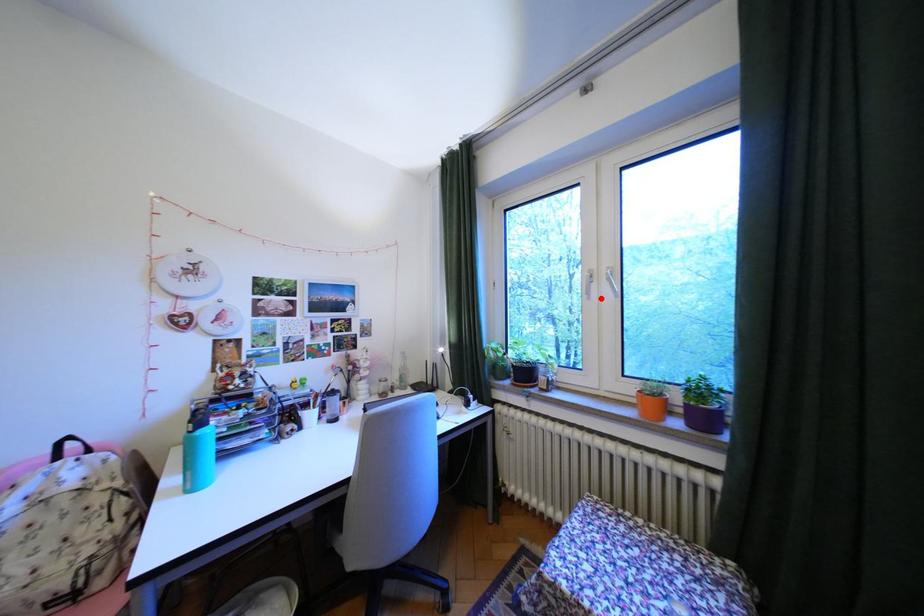
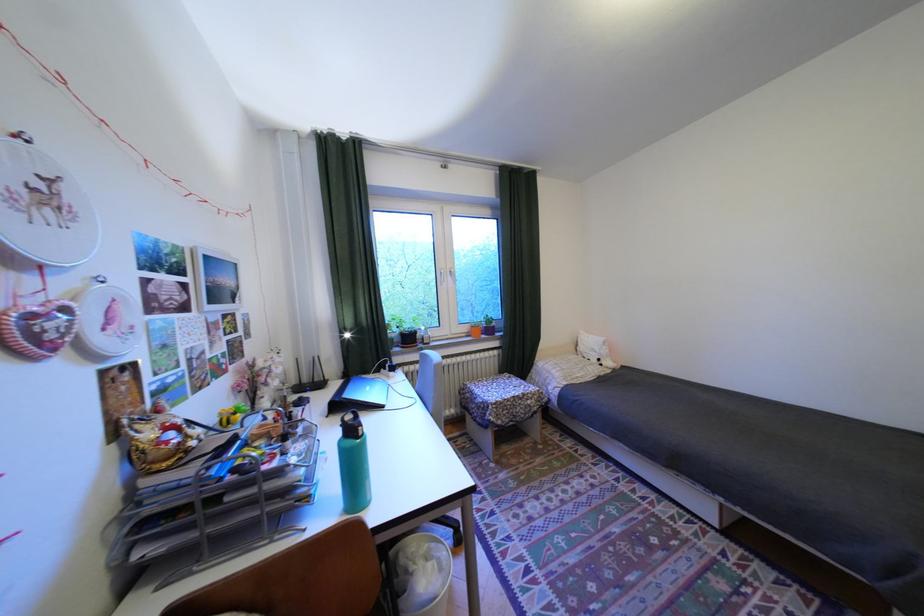
Question: I am providing you with two images of the same scene from different viewpoints. A red point is shown in image1. For the corresponding object point in image2, is it positioned nearer or farther from the camera?

Choices:
 (A) Nearer
 (B) Farther

Answer: (A)